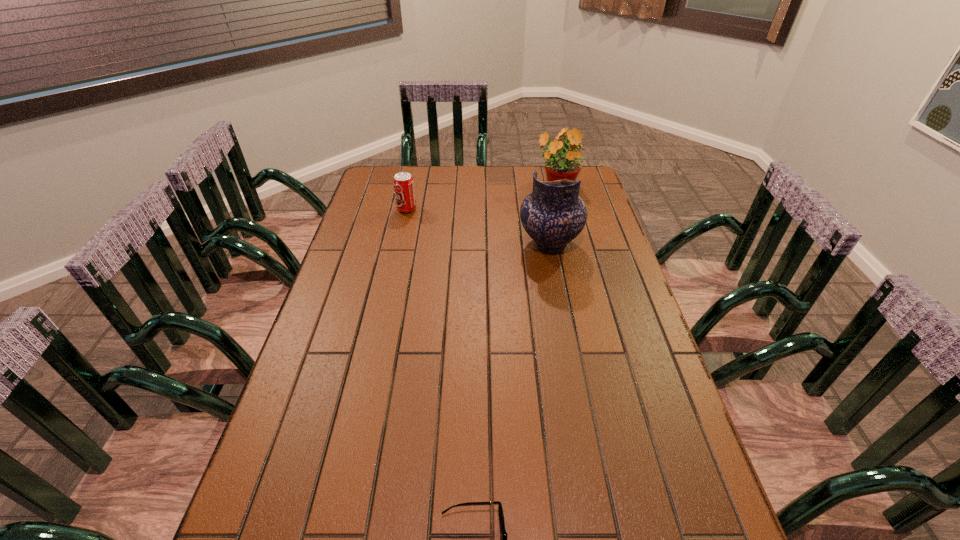
Where is `pottery`? The image size is (960, 540). pottery is located at coordinates (553, 214).

The height and width of the screenshot is (540, 960). What are the coordinates of `flowerpot` in the screenshot? It's located at (559, 165).

Locate an element on the screen. The width and height of the screenshot is (960, 540). the third tallest object is located at coordinates (403, 183).

At what (x,y) coordinates should I click in order to perform the action: click on the leftmost object. Please return your answer as a coordinate pair (x, y). Image resolution: width=960 pixels, height=540 pixels. Looking at the image, I should click on (403, 183).

I want to click on free region located on the left of the pottery, so click(459, 244).

Where is `free space located on the front of the farthest object`? Image resolution: width=960 pixels, height=540 pixels. free space located on the front of the farthest object is located at coordinates (563, 213).

Where is `vacant point located on the back of the third nearest object`? The width and height of the screenshot is (960, 540). vacant point located on the back of the third nearest object is located at coordinates (413, 183).

Find the location of `object located in the far edge section of the desktop`. object located in the far edge section of the desktop is located at coordinates (559, 165).

This screenshot has height=540, width=960. Identify the location of object at the left edge. (403, 183).

Locate an element on the screen. The width and height of the screenshot is (960, 540). pottery positioned at the right edge is located at coordinates (553, 214).